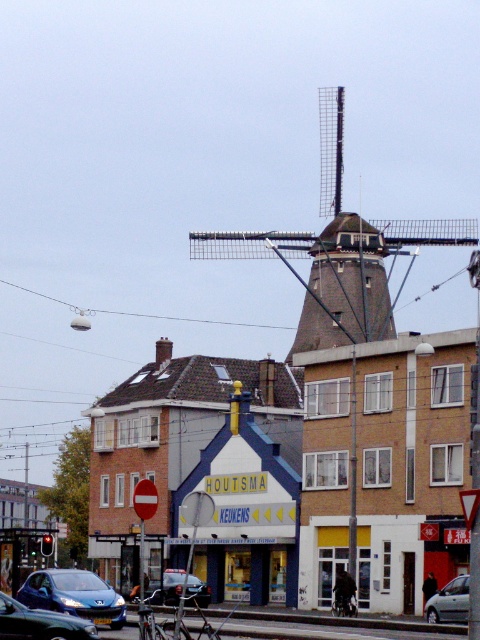
Question: Considering the real-world distances, which object is closest to the shiny blue sedan at lower left?

Choices:
 (A) metallic silver car at center
 (B) brown brick windmill at center
 (C) blue metallic hatchback at lower left

Answer: (C)

Question: Which object is the closest to the silver metallic car at lower right?

Choices:
 (A) metallic silver car at center
 (B) shiny blue sedan at lower left
 (C) blue metallic hatchback at lower left
 (D) brown brick windmill at center

Answer: (A)

Question: From the image, what is the correct spatial relationship of shiny blue sedan at lower left in relation to silver metallic car at lower right?

Choices:
 (A) above
 (B) below

Answer: (A)

Question: Considering the relative positions of blue metallic hatchback at lower left and metallic silver car at center in the image provided, where is blue metallic hatchback at lower left located with respect to metallic silver car at center?

Choices:
 (A) above
 (B) below

Answer: (A)

Question: Considering the real-world distances, which object is farthest from the blue metallic hatchback at lower left?

Choices:
 (A) metallic silver car at center
 (B) silver metallic car at lower right
 (C) brown brick windmill at center
 (D) shiny blue sedan at lower left

Answer: (C)

Question: Can you confirm if blue metallic hatchback at lower left is thinner than metallic silver car at center?

Choices:
 (A) yes
 (B) no

Answer: (B)